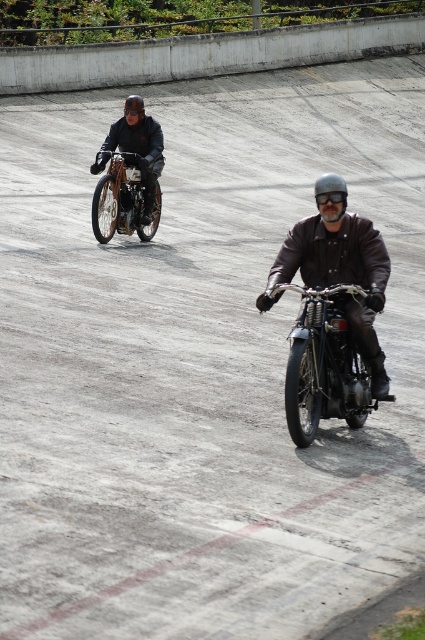
You are a photographer positioned at the origin point of the image. You want to capture a photo of the shiny chrome motorcycle at center. What are the coordinates of the motorcycle?

The coordinates of the shiny chrome motorcycle at center are at point (323,364).

What is the object located at the coordinates point [331,192]?

The object located at point [331,192] is the shiny silver helmet at center.

You are a photographer trying to capture both the shiny chrome motorcycle at center and the brushed metal helmet at upper center in a single frame. Based on their sizes, do you think they will both fit within the camera frame if the motorcycle is wider?

The shiny chrome motorcycle at center might be wider than the brushed metal helmet at upper center, so if the motorcycle is wider, it may occupy more space in the frame, but both should still fit as long as the camera angle accommodates their combined width.